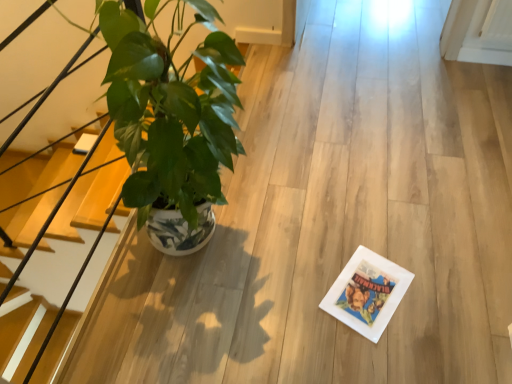
Where is `vacant area that lies in front of wooden at left`? vacant area that lies in front of wooden at left is located at coordinates (129, 338).